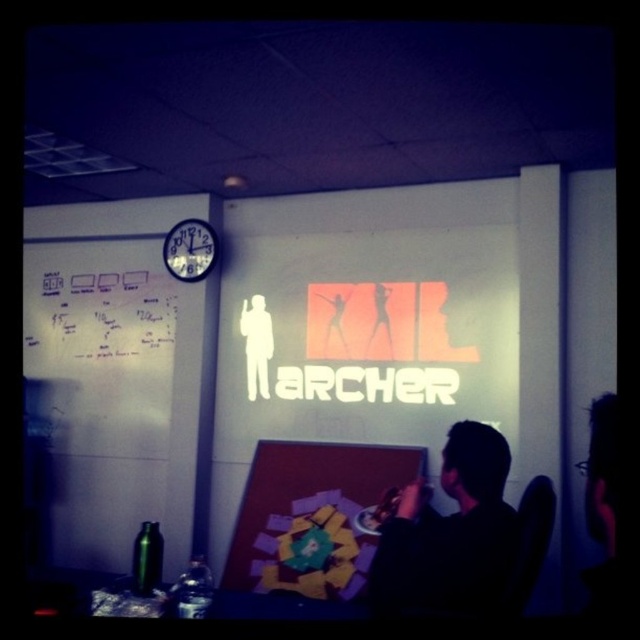
Is black matte shirt at lower right smaller than white plastic clock at upper left?

No, black matte shirt at lower right is not smaller than white plastic clock at upper left.

Is black matte shirt at lower right bigger than white plastic clock at upper left?

Yes.

Is point (474, 504) less distant than point (200, 241)?

Yes, point (474, 504) is in front of point (200, 241).

The image size is (640, 640). I want to click on black matte shirt at lower right, so click(x=449, y=532).

What do you see at coordinates (529, 545) in the screenshot?
I see `black leather chair at lower right` at bounding box center [529, 545].

Is the position of black leather chair at lower right less distant than that of white plastic clock at upper left?

Yes, it is in front of white plastic clock at upper left.

Describe the element at coordinates (529, 545) in the screenshot. The height and width of the screenshot is (640, 640). I see `black leather chair at lower right` at that location.

Locate an element on the screen. black leather chair at lower right is located at coordinates (529, 545).

Between black matte shirt at lower right and black leather chair at lower right, which one is positioned lower?

black matte shirt at lower right

Is point (493, 602) farther from camera compared to point (506, 588)?

Yes.

Find the location of `black matte shirt at lower right`. black matte shirt at lower right is located at coordinates (449, 532).

Find the location of a particular element. The height and width of the screenshot is (640, 640). black matte shirt at lower right is located at coordinates (449, 532).